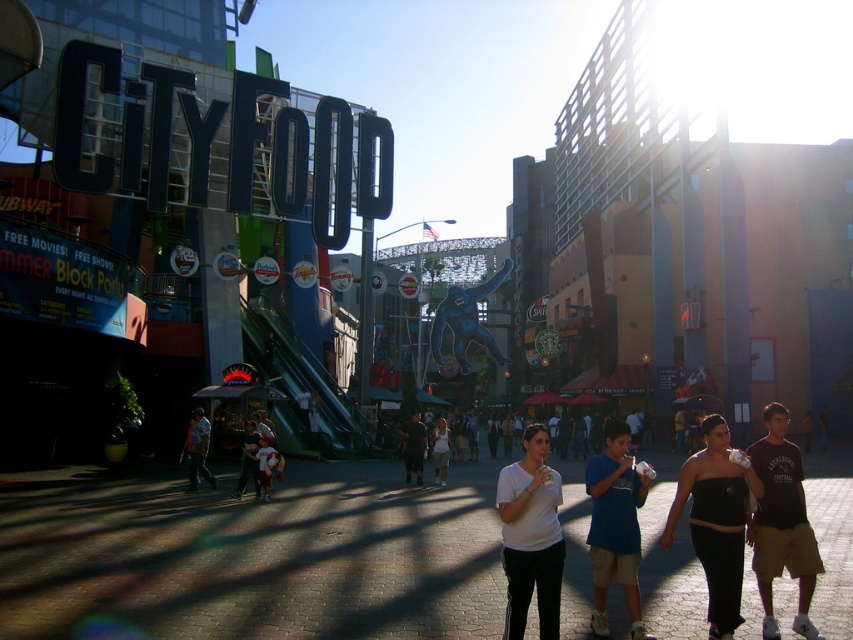
Question: Which object is positioned closest to the dark brown cotton t-shirt at center-right?

Choices:
 (A) dark blue jeans at center
 (B) blue cotton shirt at center
 (C) matte black sign at center

Answer: (B)

Question: Which of the following is the closest to the observer?

Choices:
 (A) dark blue jeans at center
 (B) black strapless dress at center
 (C) matte black sign at center

Answer: (B)

Question: Considering the relative positions of brown leather jacket at center and dark blue jeans at center in the image provided, where is brown leather jacket at center located with respect to dark blue jeans at center?

Choices:
 (A) left
 (B) right

Answer: (B)

Question: Which point is farther to the camera?

Choices:
 (A) (192, 410)
 (B) (405, 433)
 (C) (697, 493)
 (D) (770, 596)

Answer: (A)

Question: Is white matte shirt at center bigger than blue denim jeans at center?

Choices:
 (A) no
 (B) yes

Answer: (B)

Question: Can you confirm if matte black sign at center is wider than blue denim jeans at center?

Choices:
 (A) yes
 (B) no

Answer: (A)